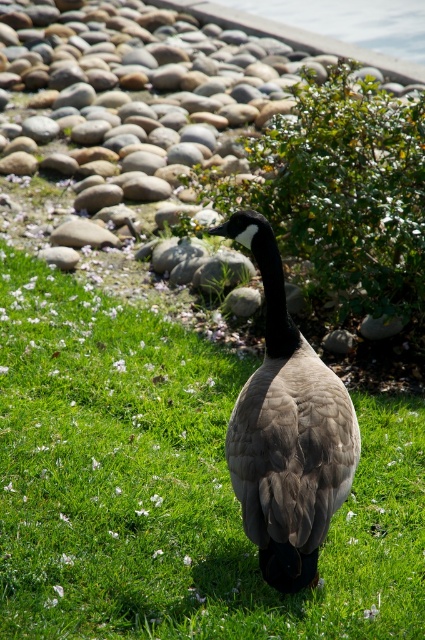
You are a drone operator trying to capture a photo of the Canada goose while avoiding the stones in the background. The point coordinates you have are point [170,486]. Where is this point located in the scene?

The point [170,486] corresponds to green grass at center, so it is located at the center of the scene where the green grass is situated.

You are a photographer trying to capture the gray downy goose at center and the green grass at center in a single shot. Based on their positions, can you tell which one is closer to the camera?

The green grass at center is located below the gray downy goose at center, which means the goose is positioned higher up in the frame. Since the grass is below the goose, it is likely closer to the camera than the goose.

You are a gardener trying to plant a small flower in the green grass at center. The gray downy goose at center is nearby. Which area has more space to accommodate the flower?

The green grass at center is bigger than the gray downy goose at center, so the green grass at center has more space to accommodate the flower.